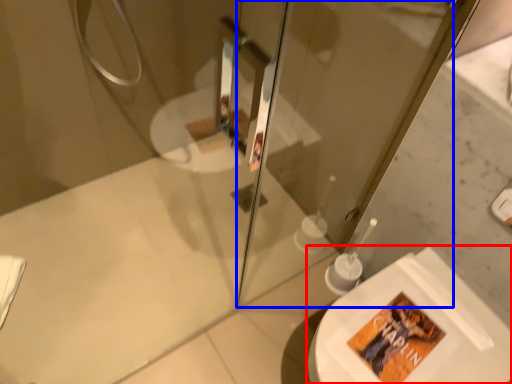
Question: Which point is further to the camera, toilet (highlighted by a red box) or screen door (highlighted by a blue box)?

Choices:
 (A) toilet
 (B) screen door

Answer: (A)